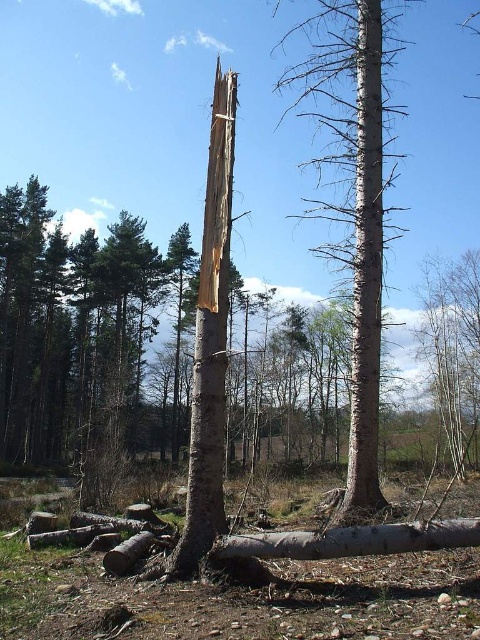
You are a hiker in the forest. You see the smooth gray bark tree at center and the bark at center. Which one is taller?

The smooth gray bark tree at center is taller than the bark at center.

Consider the image. You are a hiker who wants to identify the trees in the forest. You see the smooth gray bark tree at center and the smooth white tree trunk at center. Which one is bigger in size?

The smooth gray bark tree at center is larger in size than the smooth white tree trunk at center.